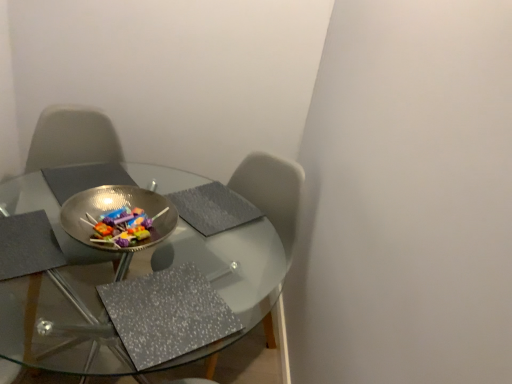
Where is `free space above transparent glass table at center (from a real-world perspective)`? This screenshot has height=384, width=512. free space above transparent glass table at center (from a real-world perspective) is located at coordinates (146, 279).